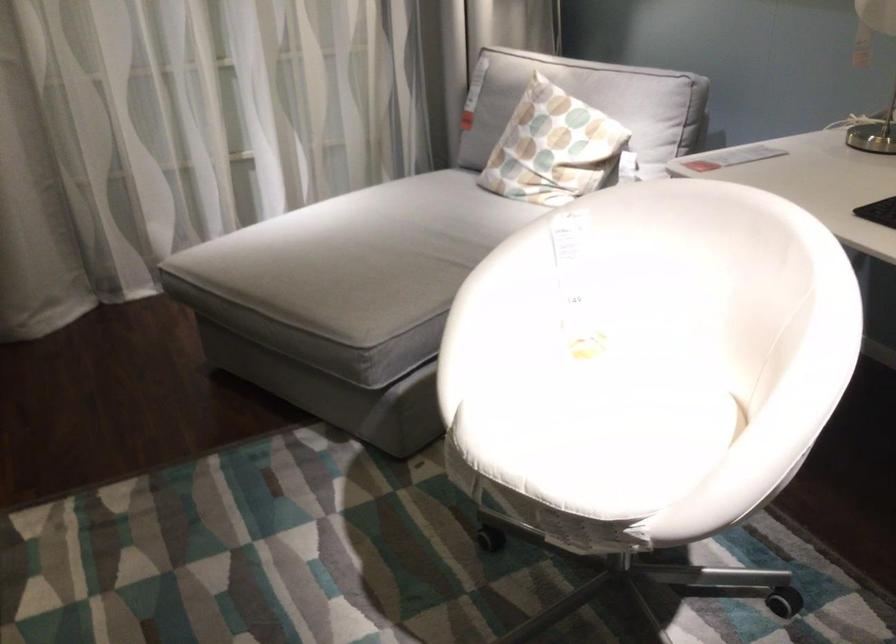
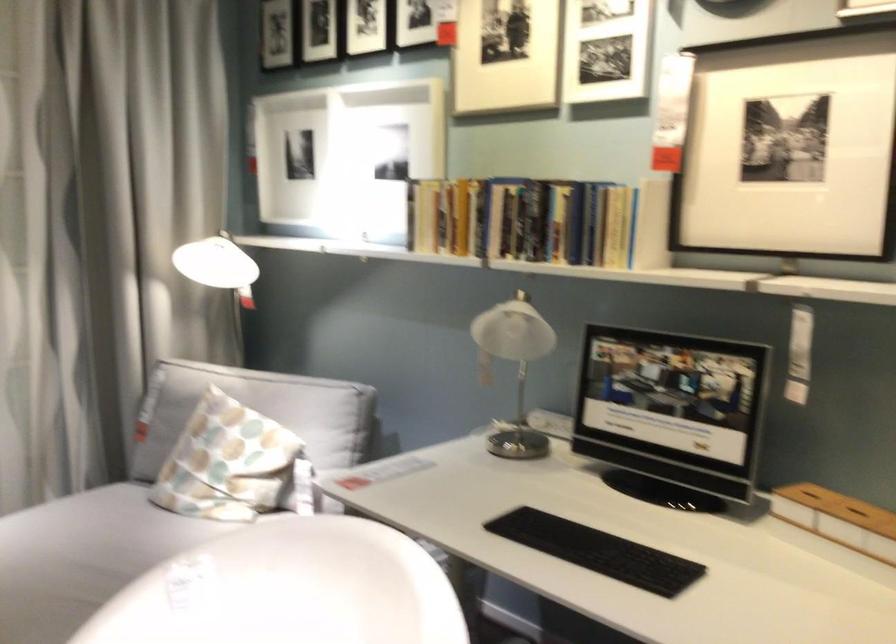
Question: The images are taken continuously from a first-person perspective. In which direction are you moving?

Choices:
 (A) Left
 (B) Right
 (C) Forward
 (D) Backward

Answer: (B)